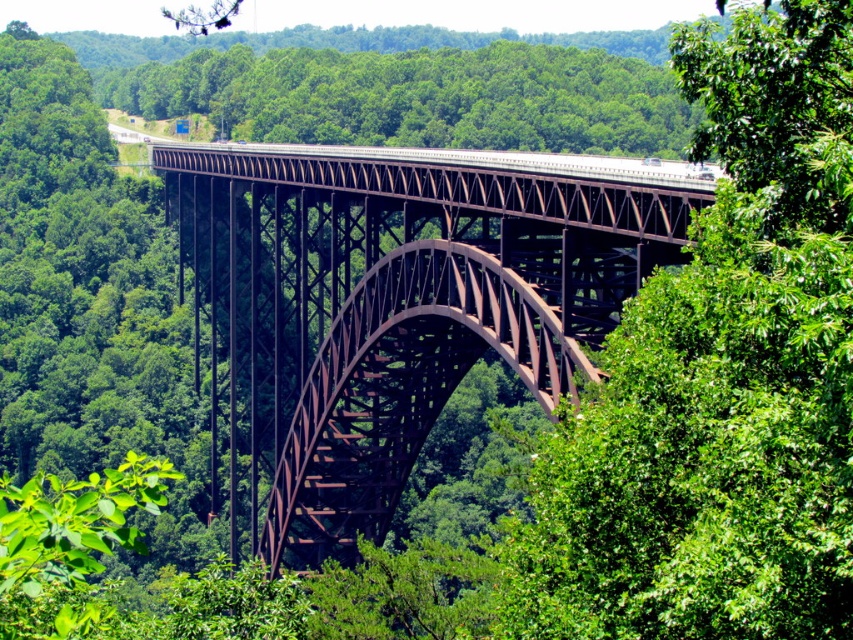
In the scene shown: Between green leafy tree at center and rusty metal arch bridge at center, which one appears on the right side from the viewer's perspective?

green leafy tree at center is more to the right.

Does point (712, 52) lie in front of point (412, 268)?

Yes.

Locate an element on the screen. This screenshot has height=640, width=853. green leafy tree at center is located at coordinates (720, 380).